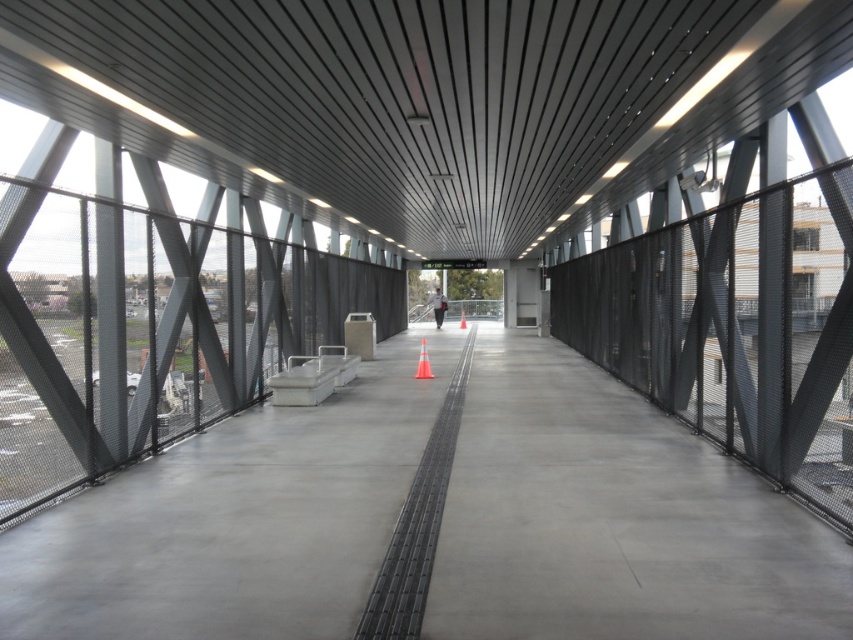
Is metallic gray overpass at center to the right of concrete at center from the viewer's perspective?

Incorrect, metallic gray overpass at center is not on the right side of concrete at center.

Does metallic gray overpass at center have a lesser height compared to concrete at center?

Incorrect, metallic gray overpass at center's height does not fall short of concrete at center's.

This screenshot has height=640, width=853. Find the location of `metallic gray overpass at center`. metallic gray overpass at center is located at coordinates (424, 99).

Is the position of concrete at center less distant than that of orange reflective cone at center?

Yes.

Who is lower down, concrete at center or orange reflective cone at center?

concrete at center is below.

Is point (485, 544) positioned before point (424, 349)?

Yes, point (485, 544) is closer to viewer.

This screenshot has height=640, width=853. Find the location of `concrete at center`. concrete at center is located at coordinates (590, 518).

Is metallic gray overpass at center above orange reflective cone at center?

Correct, metallic gray overpass at center is located above orange reflective cone at center.

Based on the photo, is metallic gray overpass at center below orange reflective cone at center?

No, metallic gray overpass at center is not below orange reflective cone at center.

You are a GUI agent. You are given a task and a screenshot of the screen. Output one action in this format:
    pyautogui.click(x=<x>, y=<y>)
    Task: Click on the metallic gray overpass at center
    
    Given the screenshot: What is the action you would take?
    pyautogui.click(x=424, y=99)

The width and height of the screenshot is (853, 640). What are the coordinates of `metallic gray overpass at center` in the screenshot? It's located at (424, 99).